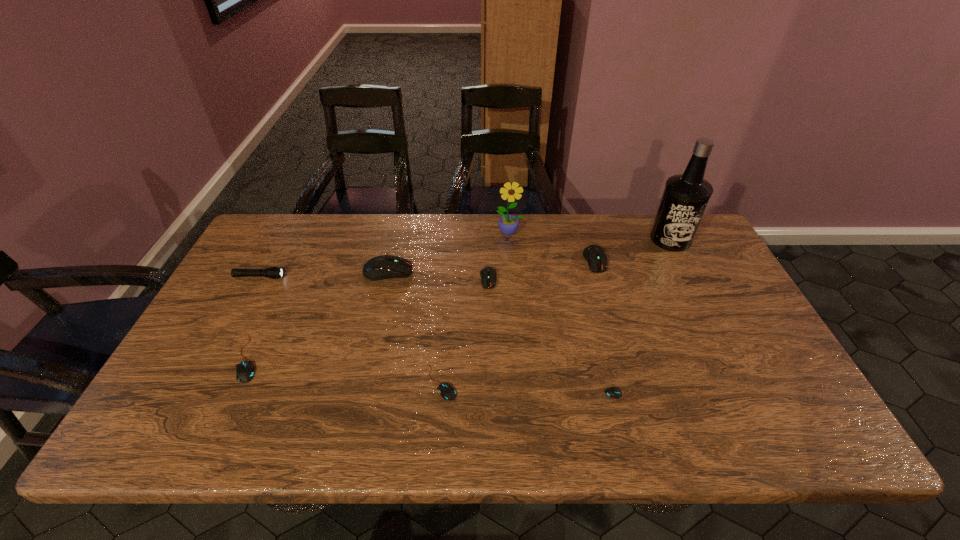
This screenshot has width=960, height=540. In order to click on vacant area between the second shortest object and the seventh object from right to left in this screenshot , I will do `click(415, 327)`.

The image size is (960, 540). In order to click on free space that is in between the leftmost dark computer equipment and the rightmost black mouse in this screenshot , I will do `click(506, 334)`.

Where is `free space between the leftmost mouse and the sixth object from left to right`? The height and width of the screenshot is (540, 960). free space between the leftmost mouse and the sixth object from left to right is located at coordinates (379, 296).

Find the location of a particular element. This screenshot has height=540, width=960. free point between the tallest mouse and the second smallest dark computer equipment is located at coordinates (492, 266).

Where is `empty location between the leftmost dark computer equipment and the flashlight`? empty location between the leftmost dark computer equipment and the flashlight is located at coordinates [324, 274].

Identify the location of free space between the leftmost mouse and the seventh object from right to left. point(319,315).

Identify the location of free space between the leftmost black mouse and the black liquor. (460, 299).

At what (x,y) coordinates should I click in order to perform the action: click on object that is the sixth closest to the second smallest black mouse. Please return your answer as a coordinate pair (x, y). The width and height of the screenshot is (960, 540). Looking at the image, I should click on (508, 224).

Locate which object is the eighth closest to the smallest black mouse. Please provide its 2D coordinates. Your answer should be formatted as a tuple, i.e. [(x, y)], where the tuple contains the x and y coordinates of a point satisfying the conditions above.

[(273, 272)]

Locate an element on the screen. This screenshot has height=540, width=960. mouse that is the closest to the flashlight is located at coordinates point(245,370).